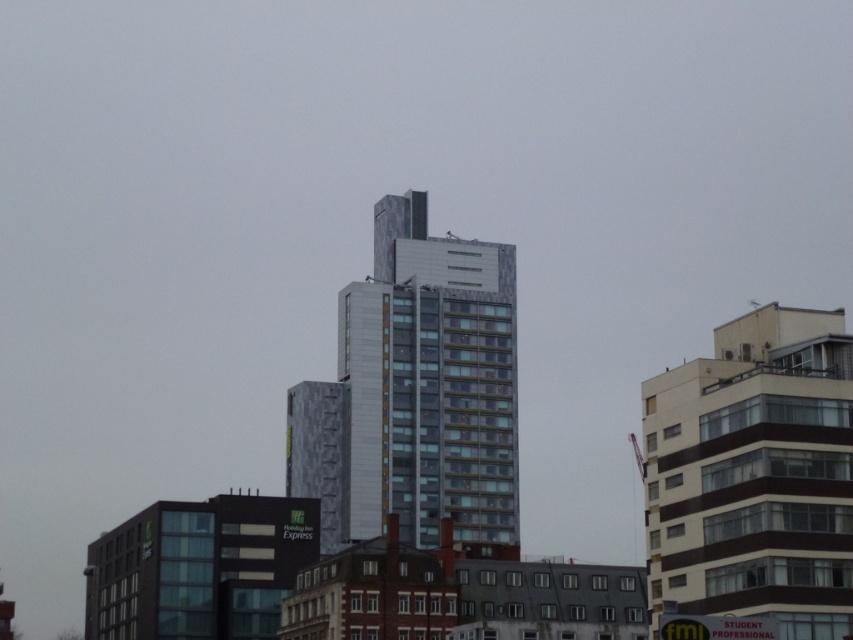
Question: Does metallic glass building at center have a larger size compared to white textured building at right?

Choices:
 (A) no
 (B) yes

Answer: (B)

Question: Where is metallic glass building at center located in relation to white textured building at right in the image?

Choices:
 (A) left
 (B) right

Answer: (A)

Question: Which object appears farthest from the camera in this image?

Choices:
 (A) metallic glass building at center
 (B) white textured building at right

Answer: (A)

Question: Is metallic glass building at center to the right of white textured building at right from the viewer's perspective?

Choices:
 (A) yes
 (B) no

Answer: (B)